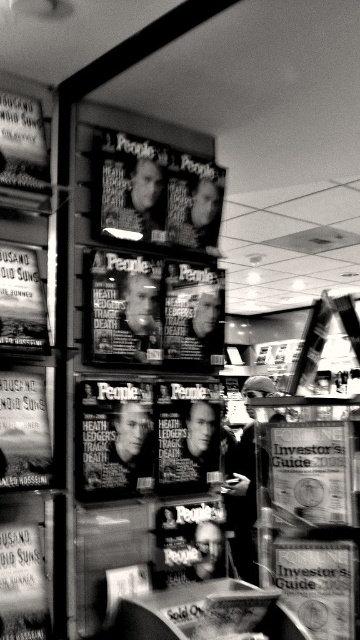
Image resolution: width=360 pixels, height=640 pixels. Identify the location of paperback book at center. (312, 470).

Which is above, paperback book at center or paperback book at lower right?

Positioned higher is paperback book at center.

Where is `paperback book at center`? paperback book at center is located at coordinates (312, 470).

Who is lower down, paperback book at lower right or smooth plastic magazine at center?

paperback book at lower right is lower down.

Who is positioned more to the left, paperback book at lower right or smooth plastic magazine at center?

smooth plastic magazine at center is more to the left.

Between point (311, 593) and point (218, 224), which one is positioned behind?

Positioned behind is point (218, 224).

Locate an element on the screen. paperback book at lower right is located at coordinates (318, 584).

Does paperback book at center come in front of matte paper poster at upper left?

No, paperback book at center is behind matte paper poster at upper left.

Is paperback book at center smaller than matte paper poster at upper left?

Actually, paperback book at center might be larger than matte paper poster at upper left.

Which is behind, point (349, 458) or point (27, 320)?

Point (349, 458)

You are a GUI agent. You are given a task and a screenshot of the screen. Output one action in this format:
    pyautogui.click(x=<x>, y=<y>)
    Task: Click on the paperback book at center
    This screenshot has width=360, height=640.
    Given the screenshot: What is the action you would take?
    pyautogui.click(x=312, y=470)